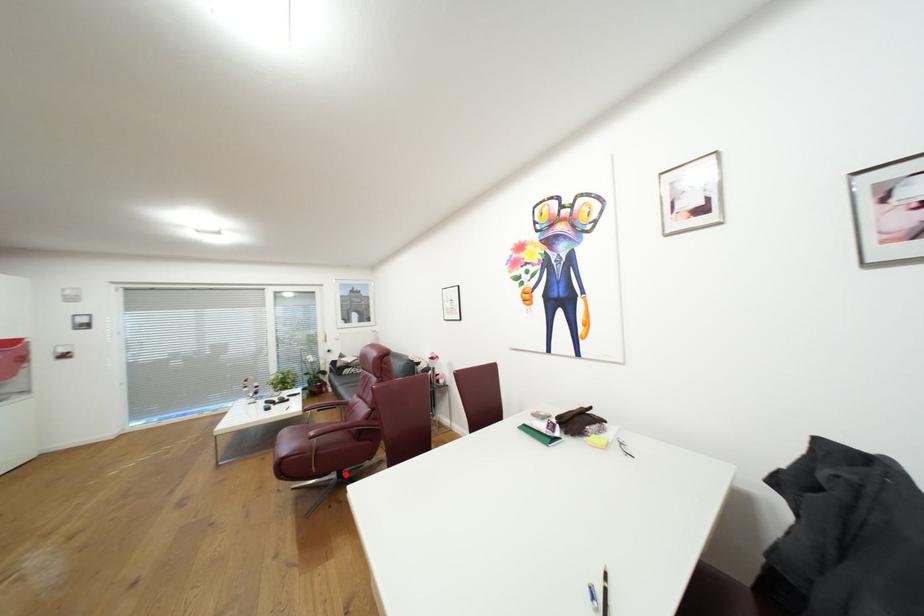
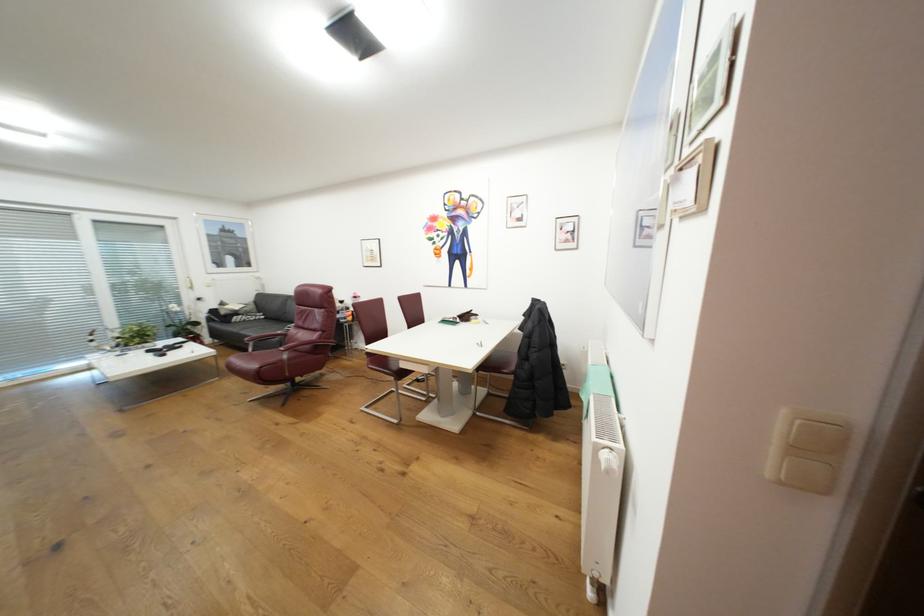
Question: I am providing you with two images of the same scene from different viewpoints. Given a red point in image1, look at the same physical point in image2. Is it:

Choices:
 (A) Closer to the viewpoint
 (B) Farther from the viewpoint

Answer: (A)